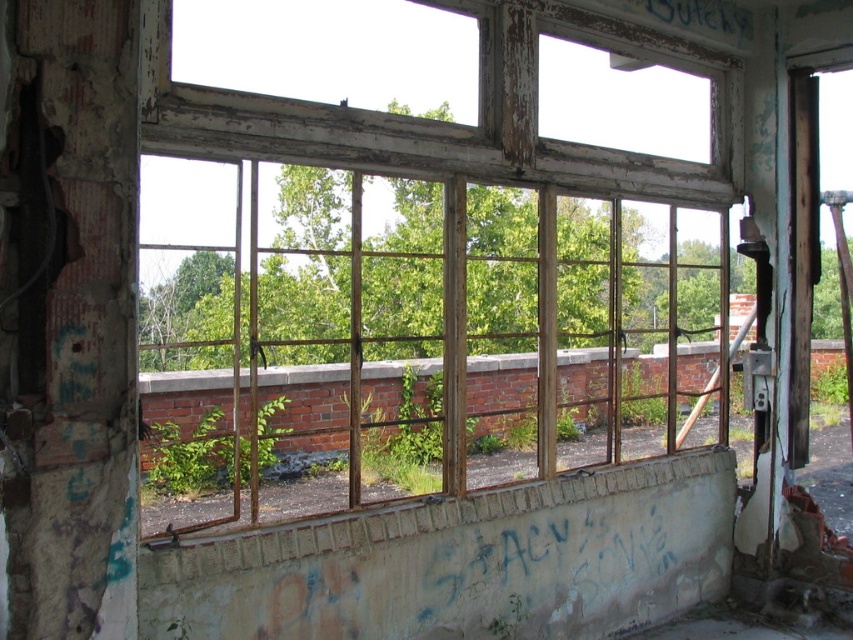
Question: Among these objects, which one is nearest to the camera?

Choices:
 (A) weathered wood window frame at center
 (B) green leafy plant at center

Answer: (A)

Question: Is weathered wood window frame at center further to the viewer compared to green leafy plant at center?

Choices:
 (A) no
 (B) yes

Answer: (A)

Question: Does weathered wood window frame at center appear on the right side of green leafy plant at center?

Choices:
 (A) yes
 (B) no

Answer: (A)

Question: Among these points, which one is farthest from the camera?

Choices:
 (A) (184, 440)
 (B) (213, 353)

Answer: (B)

Question: Is weathered wood window frame at center smaller than green leafy plant at center?

Choices:
 (A) no
 (B) yes

Answer: (A)